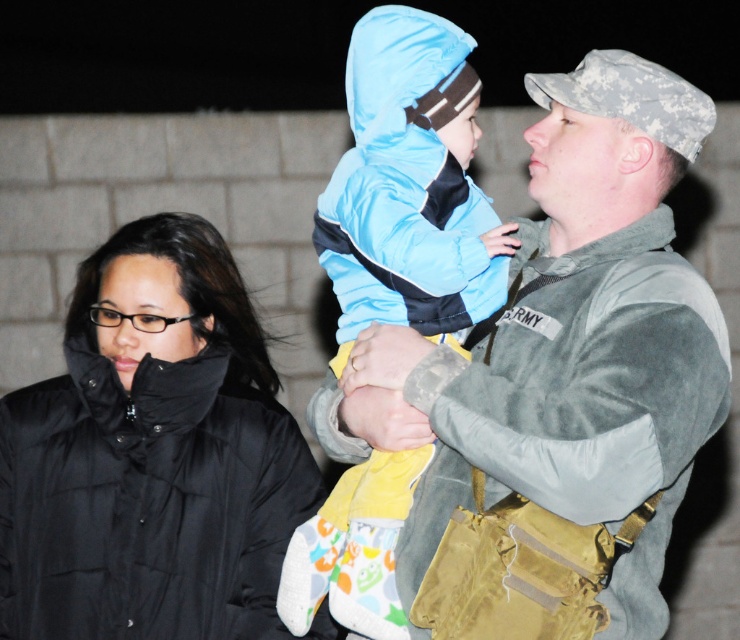
Does camouflage fabric jacket at center appear under black puffer jacket at left?

No.

Between camouflage fabric jacket at center and black puffer jacket at left, which one appears on the right side from the viewer's perspective?

Positioned to the right is camouflage fabric jacket at center.

Which is in front, point (448, 506) or point (243, 374)?

Point (448, 506)

I want to click on camouflage fabric jacket at center, so click(565, 342).